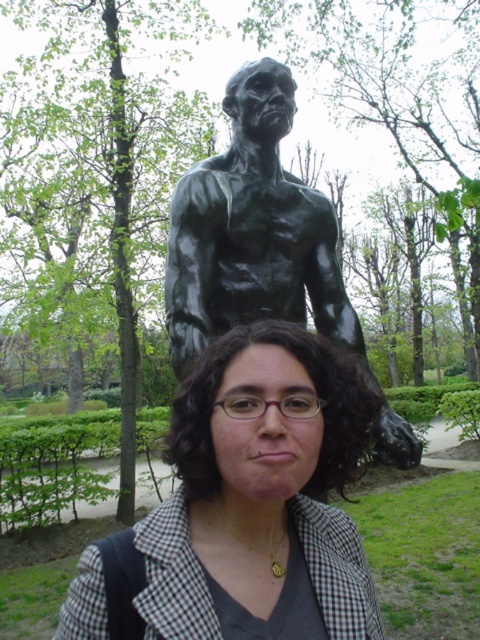
Is matte black jacket at center above bronze statue at center?

No, matte black jacket at center is not above bronze statue at center.

Locate an element on the screen. This screenshot has width=480, height=640. matte black jacket at center is located at coordinates (261, 497).

Locate an element on the screen. matte black jacket at center is located at coordinates (261, 497).